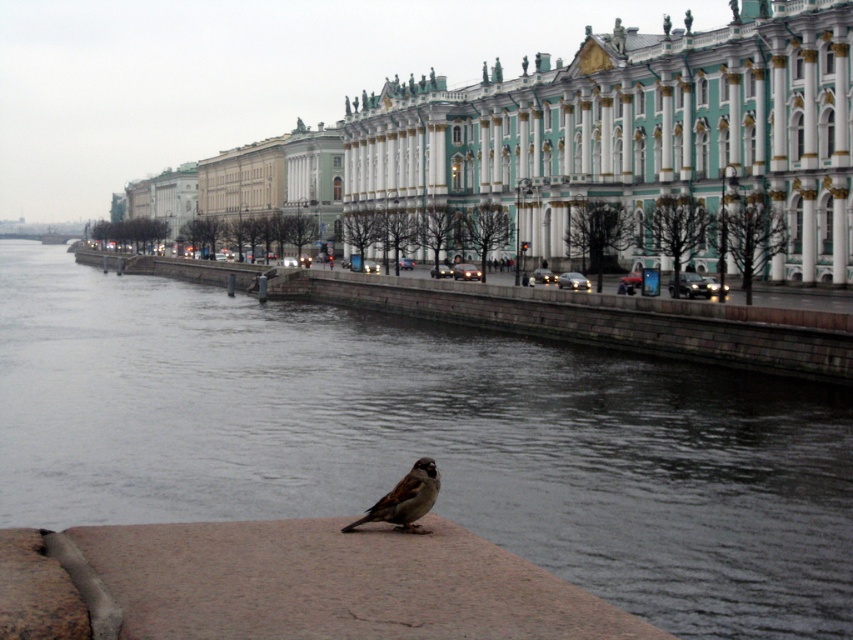
You are standing at the point with coordinates (x=427, y=440). Based on the scene description, what is the location of this point relative to the gray concrete river at center?

The point with coordinates (x=427, y=440) corresponds to the gray concrete river at center.

You are a boat captain planning to navigate a 40 meter long cargo ship through the gray concrete river at center. The ship requires a minimum of 45 meters of clearance between the green marble palace at center and the riverbank to safely pass. Is there enough space for the ship to navigate safely?

The gray concrete river at center and green marble palace at center are 42.50 meters apart. Since the ship requires 45 meters of clearance, there is insufficient space for the ship to navigate safely.

You are standing at the origin point in the image. The gray concrete river at center is located at coordinates. Can you tell me its exact coordinates?

The gray concrete river at center is located at coordinates point (427, 440).